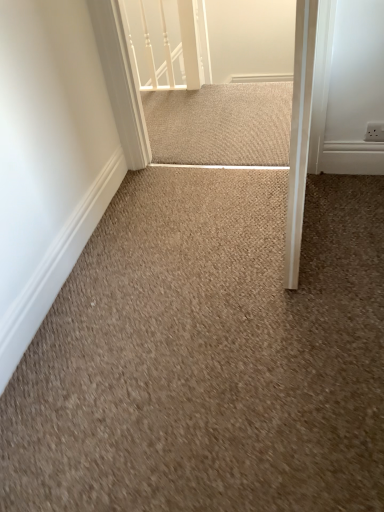
Question: Looking at the image, does beige carpet at center seem bigger or smaller compared to white glossy rail at upper center?

Choices:
 (A) big
 (B) small

Answer: (A)

Question: Considering their positions, is beige carpet at center located in front of or behind white glossy rail at upper center?

Choices:
 (A) front
 (B) behind

Answer: (A)

Question: Which object is positioned closest to the beige textured mat at center?

Choices:
 (A) beige carpet at center
 (B) white glossy rail at upper center

Answer: (B)

Question: Estimate the real-world distances between objects in this image. Which object is closer to the white glossy rail at upper center?

Choices:
 (A) beige textured mat at center
 (B) beige carpet at center

Answer: (A)